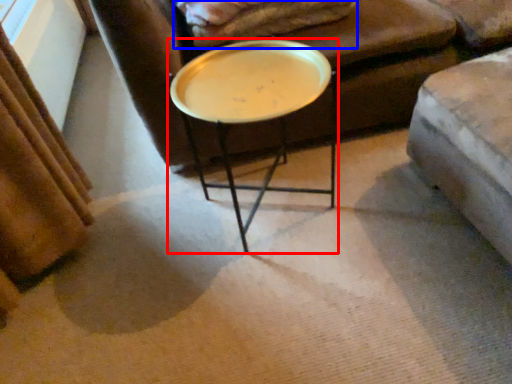
Question: Which object is further to the camera taking this photo, coffee table (highlighted by a red box) or blanket (highlighted by a blue box)?

Choices:
 (A) coffee table
 (B) blanket

Answer: (B)